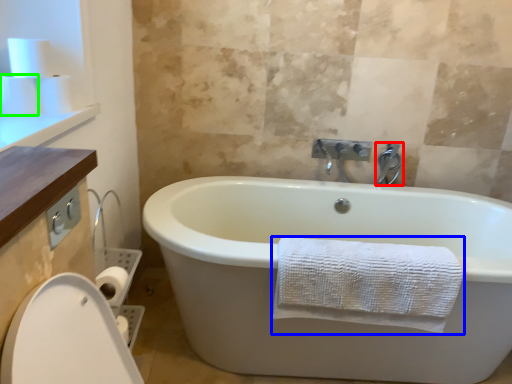
Question: Which object is positioned farthest from tap (highlighted by a red box)? Select from towel (highlighted by a blue box) and toilet paper (highlighted by a green box).

Choices:
 (A) towel
 (B) toilet paper

Answer: (B)